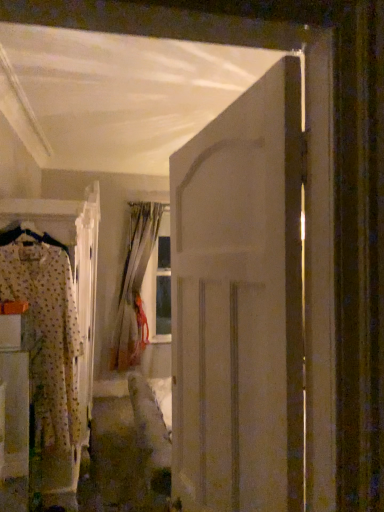
Question: Is white matte door at center bigger than fluffy fabric pajama set at left?

Choices:
 (A) yes
 (B) no

Answer: (B)

Question: Considering the relative positions of white matte door at center and fluffy fabric pajama set at left in the image provided, is white matte door at center to the left of fluffy fabric pajama set at left from the viewer's perspective?

Choices:
 (A) yes
 (B) no

Answer: (B)

Question: Can you confirm if white matte door at center is shorter than fluffy fabric pajama set at left?

Choices:
 (A) no
 (B) yes

Answer: (A)

Question: Can we say white matte door at center lies outside fluffy fabric pajama set at left?

Choices:
 (A) yes
 (B) no

Answer: (A)

Question: Are white matte door at center and fluffy fabric pajama set at left making contact?

Choices:
 (A) yes
 (B) no

Answer: (B)

Question: Is fluffy fabric pajama set at left surrounded by white matte door at center?

Choices:
 (A) yes
 (B) no

Answer: (B)

Question: From the image's perspective, would you say fluffy fabric pajama set at left is shown under white matte door at center?

Choices:
 (A) no
 (B) yes

Answer: (B)

Question: Considering the relative positions of fluffy fabric pajama set at left and white matte door at center in the image provided, is fluffy fabric pajama set at left behind white matte door at center?

Choices:
 (A) no
 (B) yes

Answer: (B)

Question: Does fluffy fabric pajama set at left have a greater width compared to white matte door at center?

Choices:
 (A) no
 (B) yes

Answer: (B)

Question: Are fluffy fabric pajama set at left and white matte door at center far apart?

Choices:
 (A) yes
 (B) no

Answer: (A)

Question: Does fluffy fabric pajama set at left have a lesser height compared to white matte door at center?

Choices:
 (A) no
 (B) yes

Answer: (B)

Question: Is fluffy fabric pajama set at left facing away from white matte door at center?

Choices:
 (A) yes
 (B) no

Answer: (B)

Question: Considering the relative sizes of patterned fabric pajamas at left and white matte door at center in the image provided, is patterned fabric pajamas at left wider than white matte door at center?

Choices:
 (A) yes
 (B) no

Answer: (A)